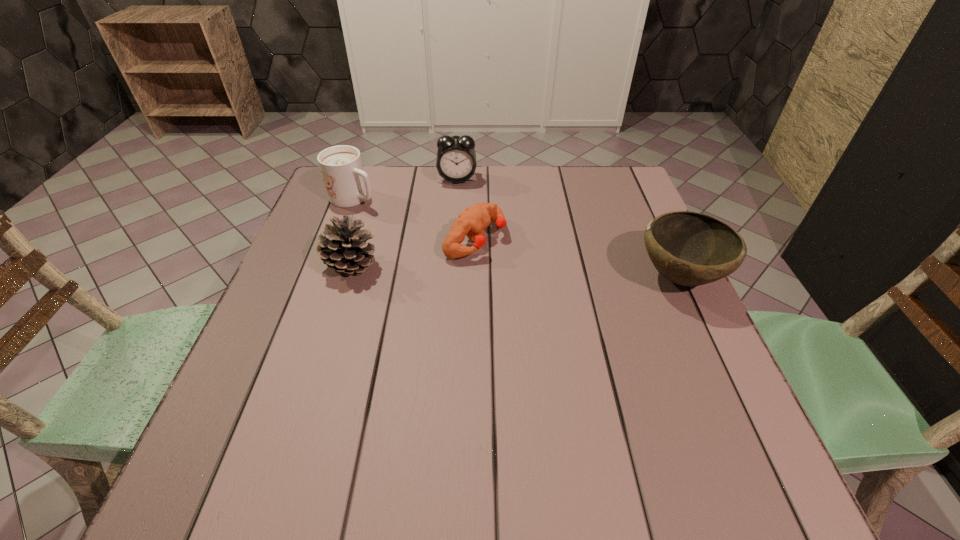
You are a GUI agent. You are given a task and a screenshot of the screen. Output one action in this format:
    pyautogui.click(x=<x>, y=<y>)
    Task: Click on the object that is positioned at the right edge
    
    Given the screenshot: What is the action you would take?
    pyautogui.click(x=687, y=248)

I want to click on object located in the far left corner section of the desktop, so click(347, 184).

Locate an element on the screen. The height and width of the screenshot is (540, 960). free space at the far edge is located at coordinates (533, 173).

The image size is (960, 540). In the image, there is a desktop. In order to click on free space at the left edge in this screenshot , I will do `click(300, 270)`.

The image size is (960, 540). I want to click on vacant space at the right edge of the desktop, so click(x=647, y=296).

At what (x,y) coordinates should I click in order to perform the action: click on free space at the near left corner. Please return your answer as a coordinate pair (x, y). Looking at the image, I should click on (302, 410).

Locate an element on the screen. The height and width of the screenshot is (540, 960). vacant space at the far right corner of the desktop is located at coordinates (606, 172).

I want to click on blank region between the bowl and the puncher, so click(577, 258).

Locate an element on the screen. vacant point located between the shortest object and the fourth nearest object is located at coordinates (415, 218).

Image resolution: width=960 pixels, height=540 pixels. Find the location of `free space between the pinecone and the shortest object`. free space between the pinecone and the shortest object is located at coordinates (413, 252).